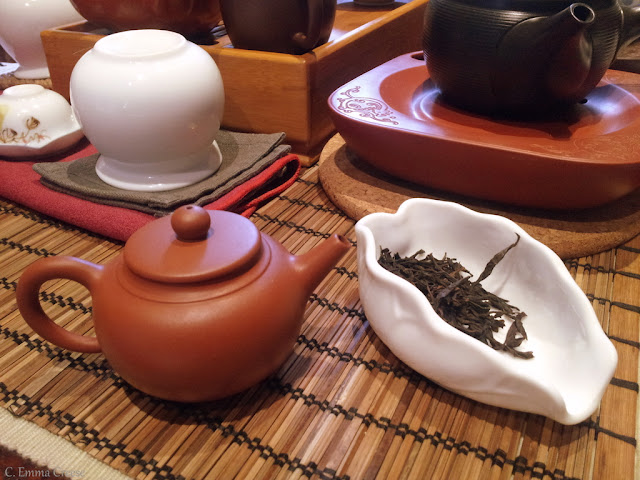
Identify the location of brown dishes. This screenshot has height=480, width=640. (210, 339), (127, 14).